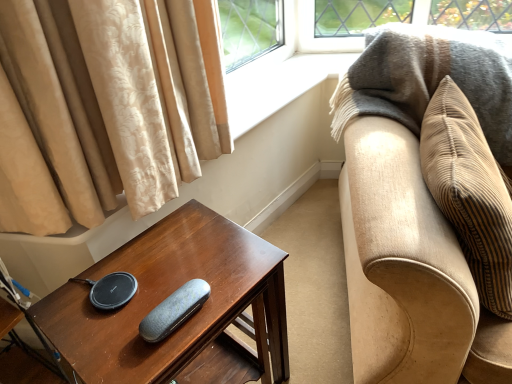
You are a GUI agent. You are given a task and a screenshot of the screen. Output one action in this format:
    pyautogui.click(x=<x>, y=<y>)
    Task: Click on the blank space to the left of textured gray case at center
    
    Given the screenshot: What is the action you would take?
    pyautogui.click(x=108, y=314)